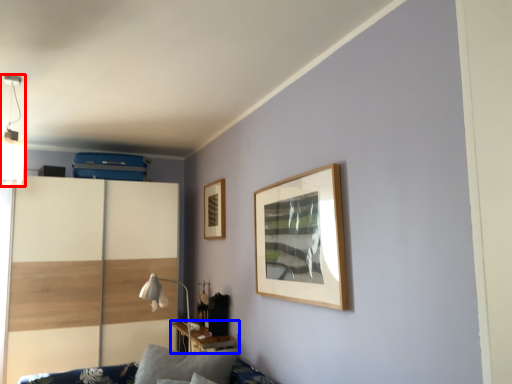
Question: Which object is closer to the camera taking this photo, light fixture (highlighted by a red box) or table (highlighted by a blue box)?

Choices:
 (A) light fixture
 (B) table

Answer: (A)